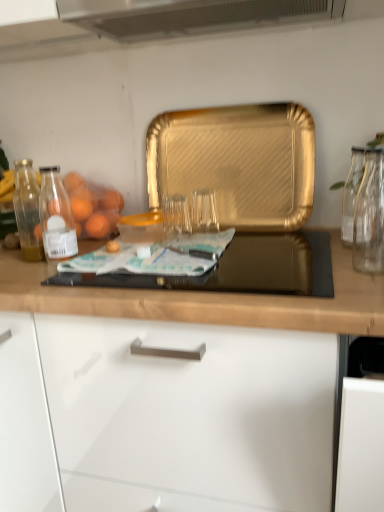
Question: From a real-world perspective, is clear glass vase at right, the second glass jar viewed from the left, located beneath gold textured tray at center?

Choices:
 (A) no
 (B) yes

Answer: (B)

Question: Can you confirm if clear glass vase at right, the second glass jar viewed from the left, is smaller than gold textured tray at center?

Choices:
 (A) no
 (B) yes

Answer: (B)

Question: Is gold textured tray at center a part of clear glass vase at right, the second glass jar viewed from the left?

Choices:
 (A) no
 (B) yes

Answer: (A)

Question: Is gold textured tray at center at the back of clear glass vase at right, the second glass jar viewed from the left?

Choices:
 (A) yes
 (B) no

Answer: (B)

Question: Does clear glass vase at right, the second glass jar viewed from the left, have a lesser height compared to gold textured tray at center?

Choices:
 (A) no
 (B) yes

Answer: (B)

Question: Would you say gold textured tray at center is to the left or to the right of clear glass vase at right, marked as the 1th glass jar in a right-to-left arrangement, in the picture?

Choices:
 (A) left
 (B) right

Answer: (A)

Question: From a real-world perspective, is gold textured tray at center physically located above or below clear glass vase at right, the second glass jar viewed from the left?

Choices:
 (A) below
 (B) above

Answer: (B)

Question: Considering the positions of point (203, 144) and point (352, 148), is point (203, 144) closer or farther from the camera than point (352, 148)?

Choices:
 (A) closer
 (B) farther

Answer: (B)

Question: Is gold textured tray at center spatially inside clear glass vase at right, marked as the 1th glass jar in a right-to-left arrangement, or outside of it?

Choices:
 (A) inside
 (B) outside

Answer: (B)

Question: Visually, is gold textured tray at center positioned to the left or to the right of black glass gas stove at center?

Choices:
 (A) right
 (B) left

Answer: (A)

Question: In terms of width, does gold textured tray at center look wider or thinner when compared to black glass gas stove at center?

Choices:
 (A) wide
 (B) thin

Answer: (B)

Question: Would you say gold textured tray at center is inside or outside black glass gas stove at center?

Choices:
 (A) inside
 (B) outside

Answer: (B)

Question: Is gold textured tray at center taller or shorter than black glass gas stove at center?

Choices:
 (A) tall
 (B) short

Answer: (A)

Question: Is transparent glass at center, the 1th glass jar from the left, bigger or smaller than gold textured tray at center?

Choices:
 (A) big
 (B) small

Answer: (B)

Question: From their relative heights in the image, would you say transparent glass at center, which appears as the 2th glass jar when viewed from the right, is taller or shorter than gold textured tray at center?

Choices:
 (A) tall
 (B) short

Answer: (B)